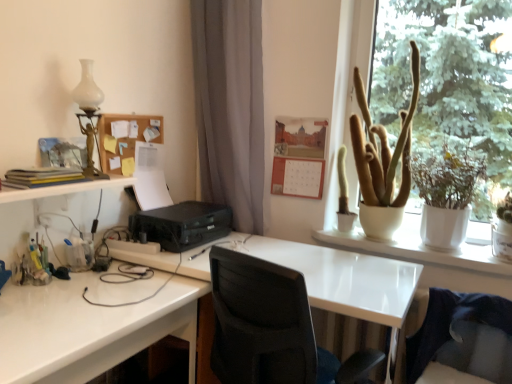
Question: Does white ceramic pot at upper right turn towards white glossy desk at lower left, which is the first desk from left to right?

Choices:
 (A) no
 (B) yes

Answer: (A)

Question: Is white ceramic pot at upper right not near white glossy desk at lower left, the second desk in the right-to-left sequence?

Choices:
 (A) yes
 (B) no

Answer: (A)

Question: Is white ceramic pot at upper right further to camera compared to white glossy desk at lower left, which is the first desk from left to right?

Choices:
 (A) no
 (B) yes

Answer: (B)

Question: From a real-world perspective, is white ceramic pot at upper right positioned under white glossy desk at lower left, which is the first desk from left to right, based on gravity?

Choices:
 (A) yes
 (B) no

Answer: (B)

Question: Considering the relative sizes of white ceramic pot at upper right and white glossy desk at lower left, which is the first desk from left to right, in the image provided, is white ceramic pot at upper right bigger than white glossy desk at lower left, which is the first desk from left to right,?

Choices:
 (A) no
 (B) yes

Answer: (A)

Question: In the image, is white ceramic pot at upper right positioned in front of or behind matte yellow book at left?

Choices:
 (A) behind
 (B) front

Answer: (A)

Question: Does point (368, 16) appear closer or farther from the camera than point (68, 182)?

Choices:
 (A) closer
 (B) farther

Answer: (B)

Question: Is white ceramic pot at upper right bigger or smaller than matte yellow book at left?

Choices:
 (A) big
 (B) small

Answer: (A)

Question: From a real-world perspective, is white ceramic pot at upper right above or below matte yellow book at left?

Choices:
 (A) below
 (B) above

Answer: (B)

Question: Choose the correct answer: Is white glossy desk at center, placed as the first desk when sorted from right to left, inside white glass table lamp at upper left or outside it?

Choices:
 (A) outside
 (B) inside

Answer: (A)

Question: Considering the positions of white glossy desk at center, positioned as the second desk in left-to-right order, and white glass table lamp at upper left in the image, is white glossy desk at center, positioned as the second desk in left-to-right order, bigger or smaller than white glass table lamp at upper left?

Choices:
 (A) big
 (B) small

Answer: (A)

Question: In the image, is white glossy desk at center, positioned as the second desk in left-to-right order, positioned in front of or behind white glass table lamp at upper left?

Choices:
 (A) front
 (B) behind

Answer: (A)

Question: In terms of width, does white glossy desk at center, placed as the first desk when sorted from right to left, look wider or thinner when compared to white glass table lamp at upper left?

Choices:
 (A) thin
 (B) wide

Answer: (B)

Question: Is black plastic printer at center taller or shorter than orange matte calendar at upper center, arranged as the second bulletin board when viewed from the left?

Choices:
 (A) short
 (B) tall

Answer: (A)

Question: Is point (210, 221) closer or farther from the camera than point (290, 155)?

Choices:
 (A) closer
 (B) farther

Answer: (A)